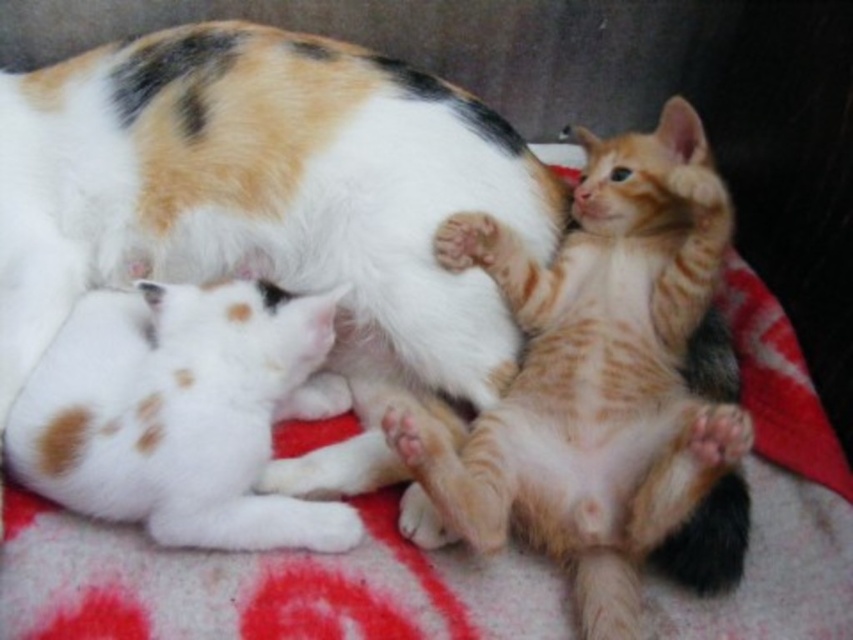
Is orange tabby kitten at center positioned before white soft fur kitten at lower left?

Yes, orange tabby kitten at center is in front of white soft fur kitten at lower left.

Does orange tabby kitten at center have a lesser width compared to white soft fur kitten at lower left?

In fact, orange tabby kitten at center might be wider than white soft fur kitten at lower left.

This screenshot has height=640, width=853. I want to click on orange tabby kitten at center, so click(596, 372).

You are a GUI agent. You are given a task and a screenshot of the screen. Output one action in this format:
    pyautogui.click(x=<x>, y=<y>)
    Task: Click on the orange tabby kitten at center
    
    Given the screenshot: What is the action you would take?
    pyautogui.click(x=596, y=372)